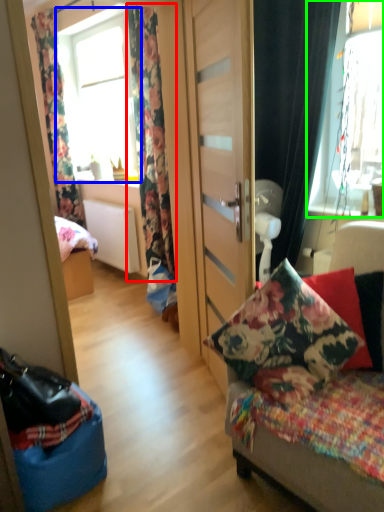
Question: Which is nearer to the curtain (highlighted by a red box)? window (highlighted by a blue box) or window (highlighted by a green box).

Choices:
 (A) window
 (B) window

Answer: (B)